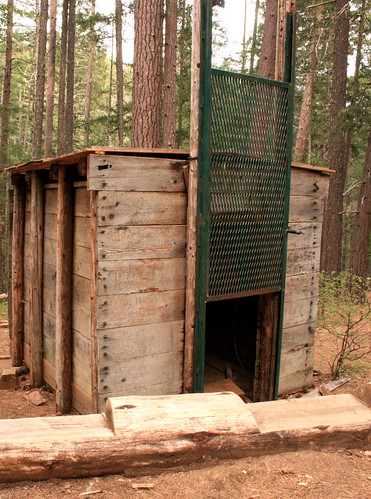
Locate an element on the screen. The height and width of the screenshot is (499, 371). left of door is located at coordinates (126, 315).